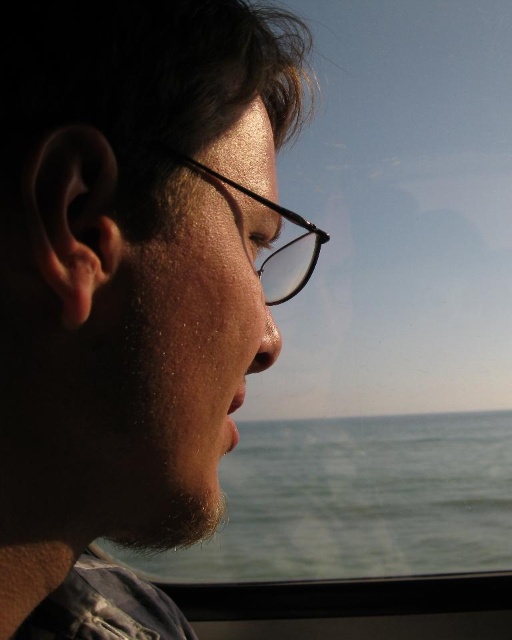
You are a photographer trying to capture the reflection of the black plastic glasses at center in the olive green water at lower center. Based on their sizes, do you think the reflection will be smaller or larger than the actual glasses?

The olive green water at lower center is larger in size than black plastic glasses at center, so the reflection of the black plastic glasses at center in the olive green water at lower center would be smaller than the actual glasses.

You are an artist trying to sketch this scene. You need to ensure the black plastic glasses at center are proportionally accurate compared to the olive green water at lower center. Based on the scene, which object should you draw wider?

The olive green water at lower center should be drawn wider since its width surpasses that of the black plastic glasses at center.

Based on the photo, you are a photographer adjusting your camera settings to focus on the black plastic glasses at center and the olive green water at lower center. Which object should you focus on first to ensure proper depth of field?

The black plastic glasses at center should be focused on first because it is closer to the viewer than the olive green water at lower center, allowing for better depth of field adjustment.